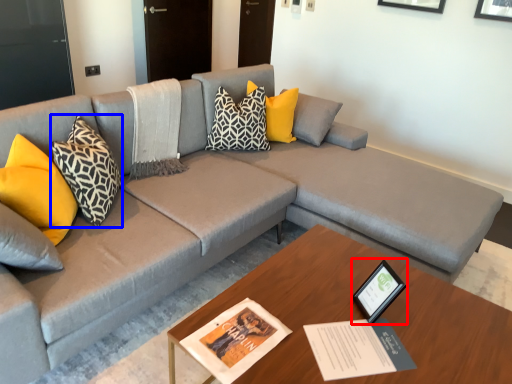
Question: Among these objects, which one is farthest to the camera, picture frame (highlighted by a red box) or pillow (highlighted by a blue box)?

Choices:
 (A) picture frame
 (B) pillow

Answer: (B)